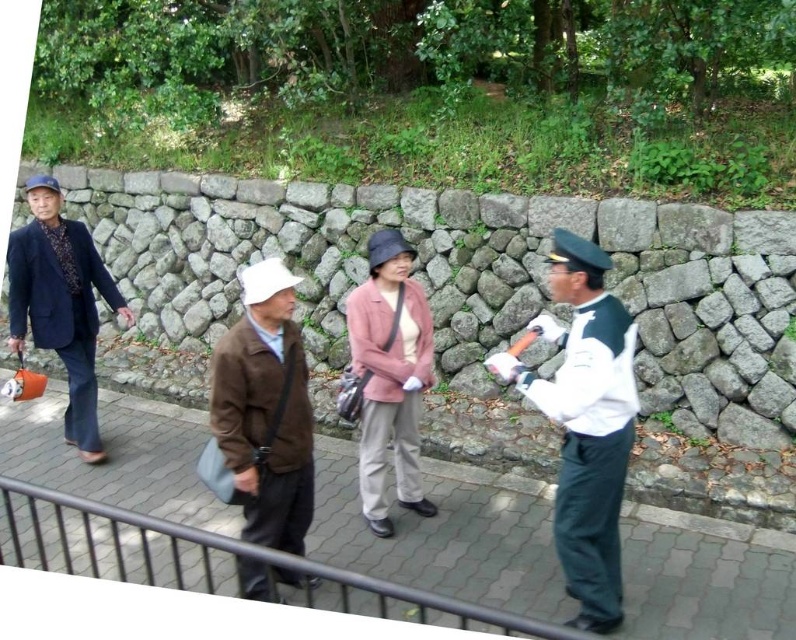
You are a pedestrian standing on the gray cobblestone pavement at center. There is a pink fabric jacket at center nearby. Which object occupies more space in the scene?

The gray cobblestone pavement at center occupies more space in the scene than the pink fabric jacket at center because it is bigger.

You are standing on the gray cobblestone pavement at center and looking towards the pink fabric jacket at center. Which object is lower in height?

The gray cobblestone pavement at center is lower in height compared to the pink fabric jacket at center.

You are standing on the pathway and want to pick up both jackets, the brown leather jacket at center and the pink fabric jacket at center, to hand them to a lost and found. Can you reach both jackets without moving your feet? The average person has an arm reach of about 30 inches from their body.

The brown leather jacket at center is 28.94 inches away from the pink fabric jacket at center. Since the distance between them is less than the average arm reach of 30 inches, you can reach both jackets without moving your feet.